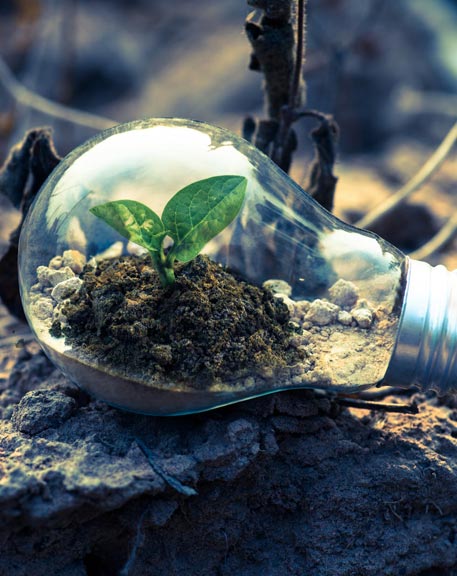
At what (x,y) coordinates should I click in order to perform the action: click on glass part of lightbulb. Please return your answer as a coordinate pair (x, y). The width and height of the screenshot is (457, 576). Looking at the image, I should click on (268, 242).